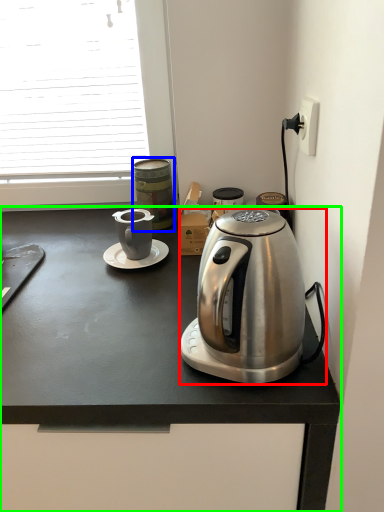
Question: Estimate the real-world distances between objects in this image. Which object is farther from coffee maker (highlighted by a red box), appliance (highlighted by a blue box) or desk (highlighted by a green box)?

Choices:
 (A) appliance
 (B) desk

Answer: (A)